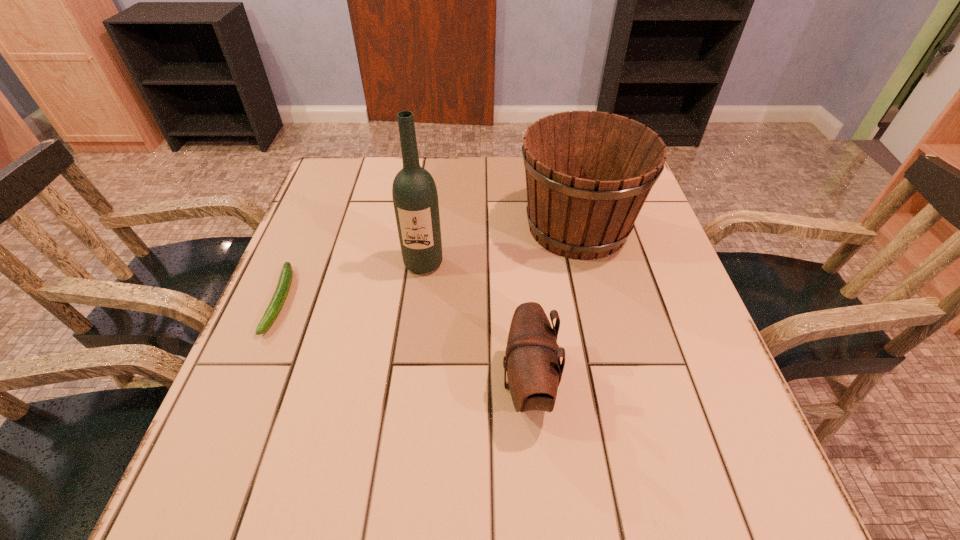
Locate an element on the screen. vacant space located with the flap open on the third tallest object is located at coordinates (346, 386).

Where is `vacant space located with the flap open on the third tallest object`? This screenshot has width=960, height=540. vacant space located with the flap open on the third tallest object is located at coordinates (312, 386).

Identify the location of free space located on the front-facing side of the zucchini. The image size is (960, 540). (204, 483).

Identify the location of object at the far edge. (588, 174).

The height and width of the screenshot is (540, 960). I want to click on object positioned at the left edge, so click(286, 275).

Find the location of `object situated at the right edge`. object situated at the right edge is located at coordinates (588, 174).

What are the coordinates of `object present at the far right corner` in the screenshot? It's located at (x=588, y=174).

Locate an element on the screen. The image size is (960, 540). vacant space at the far edge of the desktop is located at coordinates (492, 206).

In the image, there is a desktop. Where is `free space at the near edge`? free space at the near edge is located at coordinates (510, 484).

In the image, there is a desktop. Where is `vacant space at the left edge`? Image resolution: width=960 pixels, height=540 pixels. vacant space at the left edge is located at coordinates (263, 413).